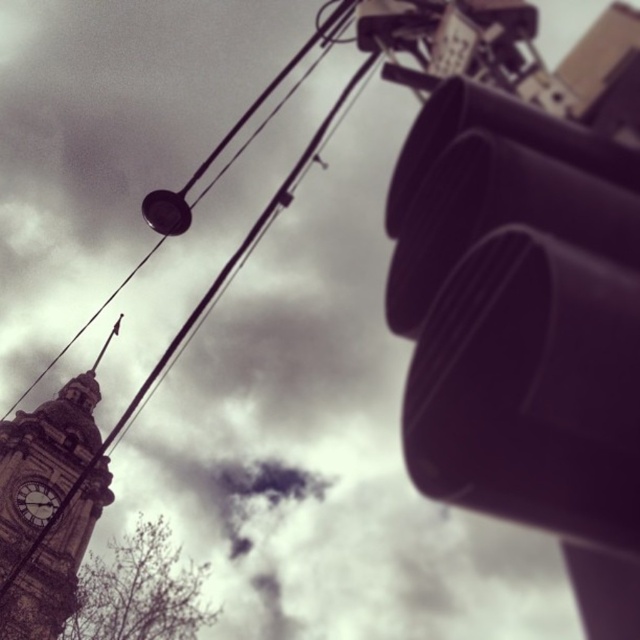
Who is positioned more to the right, matte black traffic light at right or dark gray stone clock at lower left?

From the viewer's perspective, matte black traffic light at right appears more on the right side.

Does matte black traffic light at right have a lesser height compared to dark gray stone clock at lower left?

No, matte black traffic light at right is not shorter than dark gray stone clock at lower left.

What do you see at coordinates (524, 328) in the screenshot? I see `matte black traffic light at right` at bounding box center [524, 328].

Locate an element on the screen. The height and width of the screenshot is (640, 640). matte black traffic light at right is located at coordinates (524, 328).

Which is above, matte black traffic light at right or brown stone clock tower at left?

matte black traffic light at right is higher up.

Between matte black traffic light at right and brown stone clock tower at left, which one is positioned lower?

brown stone clock tower at left is lower down.

Locate an element on the screen. matte black traffic light at right is located at coordinates (524, 328).

This screenshot has width=640, height=640. In order to click on matte black traffic light at right in this screenshot , I will do `click(524, 328)`.

Does black wire at upper left appear on the right side of dark gray stone clock at lower left?

Correct, you'll find black wire at upper left to the right of dark gray stone clock at lower left.

Which is more to the right, black wire at upper left or dark gray stone clock at lower left?

Positioned to the right is black wire at upper left.

Which is behind, point (321, 26) or point (24, 513)?

The point (24, 513) is behind.

Image resolution: width=640 pixels, height=640 pixels. I want to click on black wire at upper left, so click(291, 67).